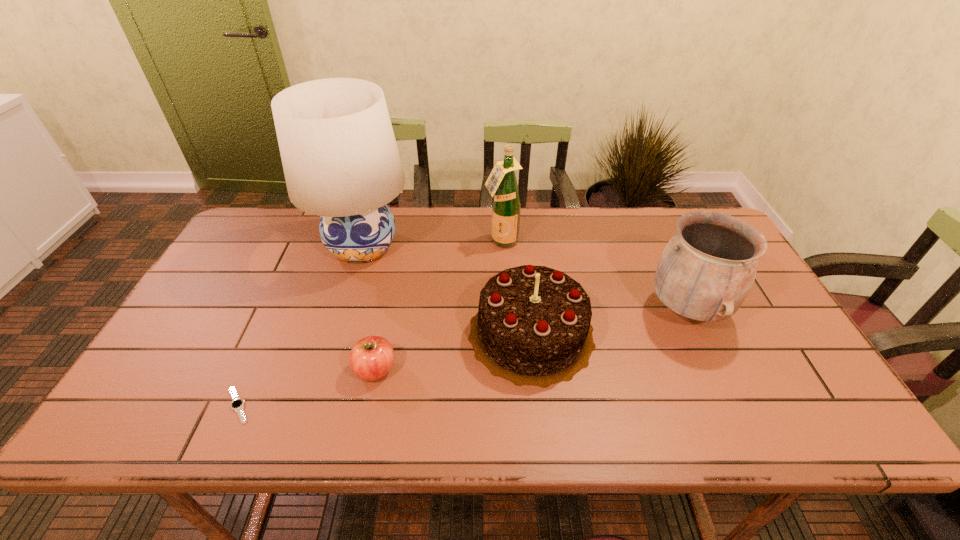
Where is `vacant point that satisfies the following two spatial constraints: 1. on the front-facing side of the tallest object; 2. on the left side of the birthday cake`? The width and height of the screenshot is (960, 540). vacant point that satisfies the following two spatial constraints: 1. on the front-facing side of the tallest object; 2. on the left side of the birthday cake is located at coordinates (336, 333).